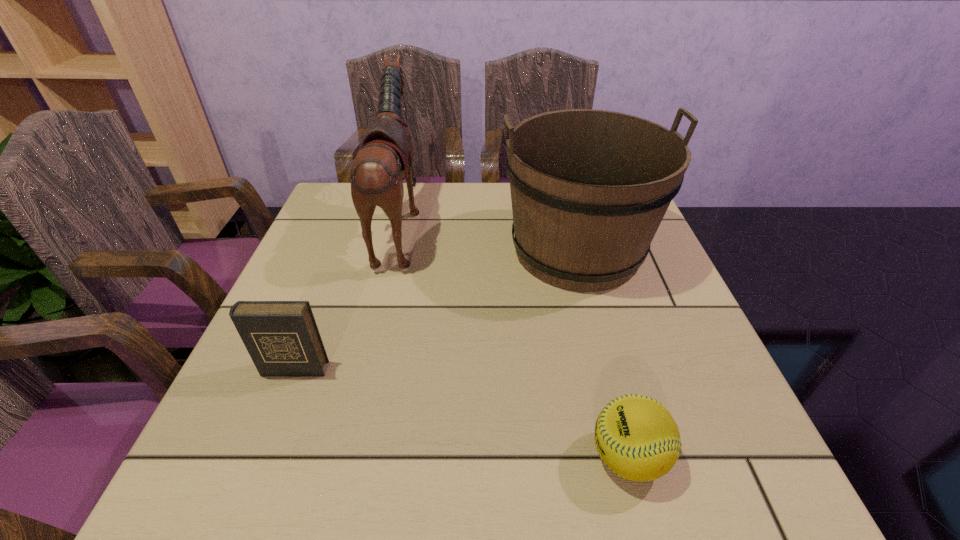
Identify the location of vacant space located 0.230m on the logo side of the shortest object. (441, 457).

Find the location of a particular element. The width and height of the screenshot is (960, 540). free location located on the logo side of the shortest object is located at coordinates (499, 457).

At what (x,y) coordinates should I click in order to perform the action: click on saddle that is at the far edge. Please return your answer as a coordinate pair (x, y). Looking at the image, I should click on (385, 156).

In order to click on bucket positioned at the far edge in this screenshot , I will do `click(589, 188)`.

I want to click on object that is positioned at the near edge, so click(x=636, y=437).

Find the location of a particular element. object that is positioned at the left edge is located at coordinates (282, 338).

I want to click on bucket that is at the right edge, so click(x=589, y=188).

I want to click on softball that is at the right edge, so click(x=636, y=437).

At what (x,y) coordinates should I click in order to perform the action: click on object that is at the far right corner. Please return your answer as a coordinate pair (x, y). The width and height of the screenshot is (960, 540). Looking at the image, I should click on (589, 188).

Locate an element on the screen. The height and width of the screenshot is (540, 960). object at the near right corner is located at coordinates (636, 437).